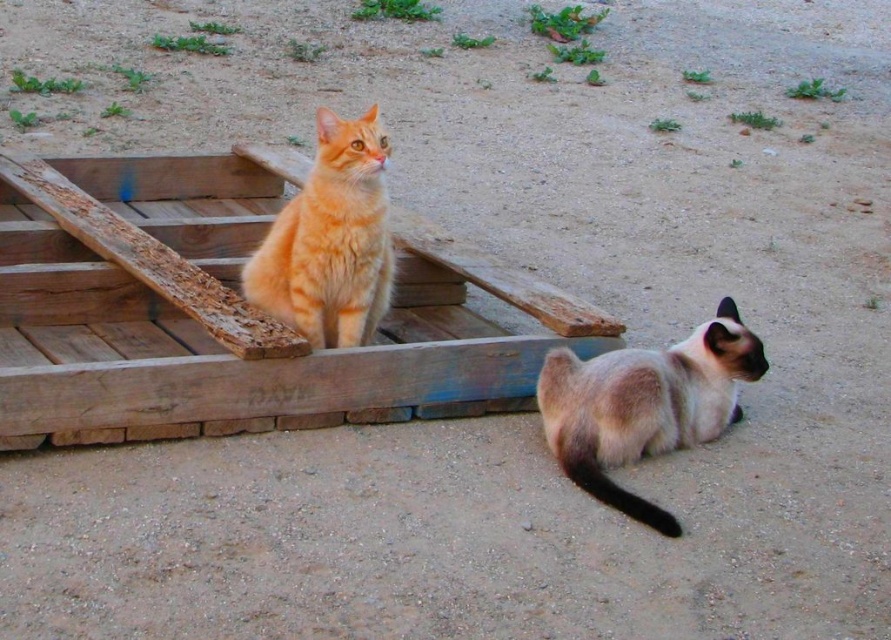
Question: Can you confirm if silky fur cat at lower right is positioned above orange fur cat at upper left?

Choices:
 (A) no
 (B) yes

Answer: (A)

Question: Does silky fur cat at lower right have a lesser width compared to orange fur cat at upper left?

Choices:
 (A) no
 (B) yes

Answer: (A)

Question: Which point is closer to the camera taking this photo?

Choices:
 (A) (325, 291)
 (B) (628, 456)

Answer: (B)

Question: Which of the following is the closest to the observer?

Choices:
 (A) silky fur cat at lower right
 (B) orange fur cat at upper left

Answer: (A)

Question: Is silky fur cat at lower right wider than orange fur cat at upper left?

Choices:
 (A) yes
 (B) no

Answer: (A)